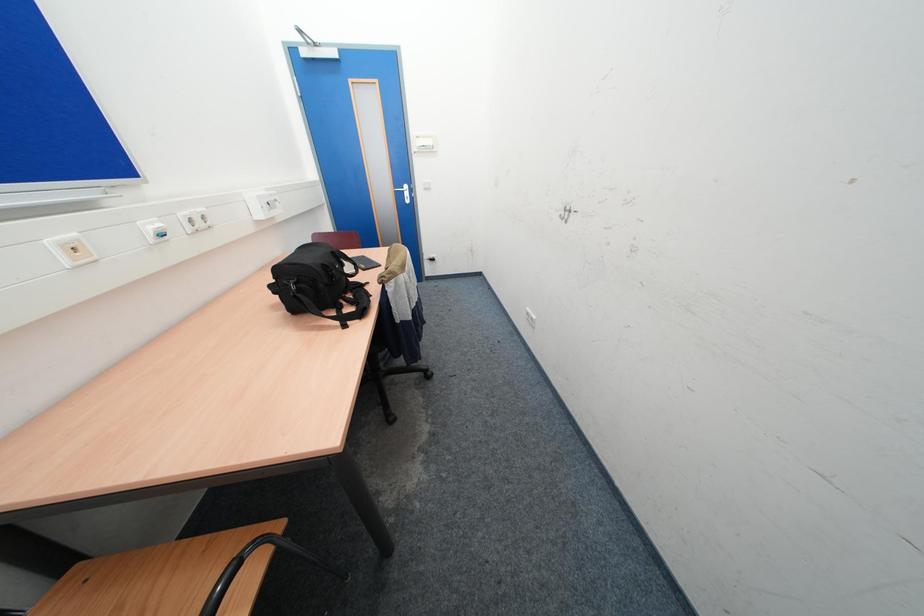
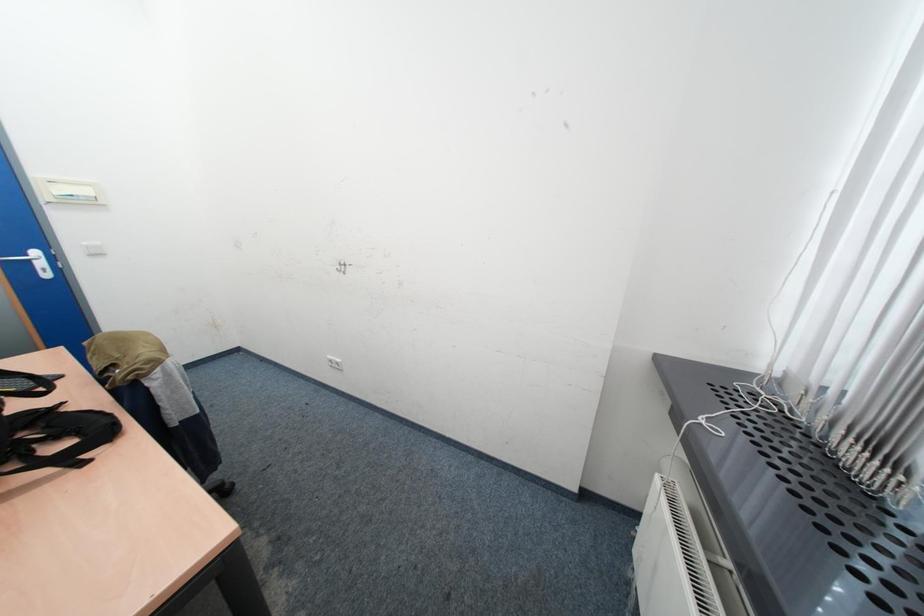
Question: The camera is either moving clockwise (left) or counter-clockwise (right) around the object. The first image is from the beginning of the video and the second image is from the end. Is the camera moving left or right when shooting the video?

Choices:
 (A) Left
 (B) Right

Answer: (A)